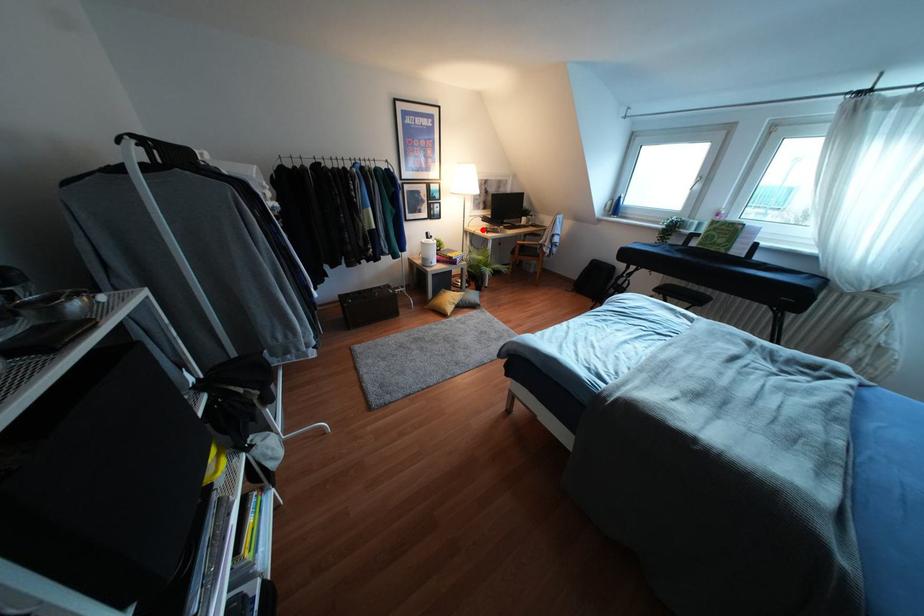
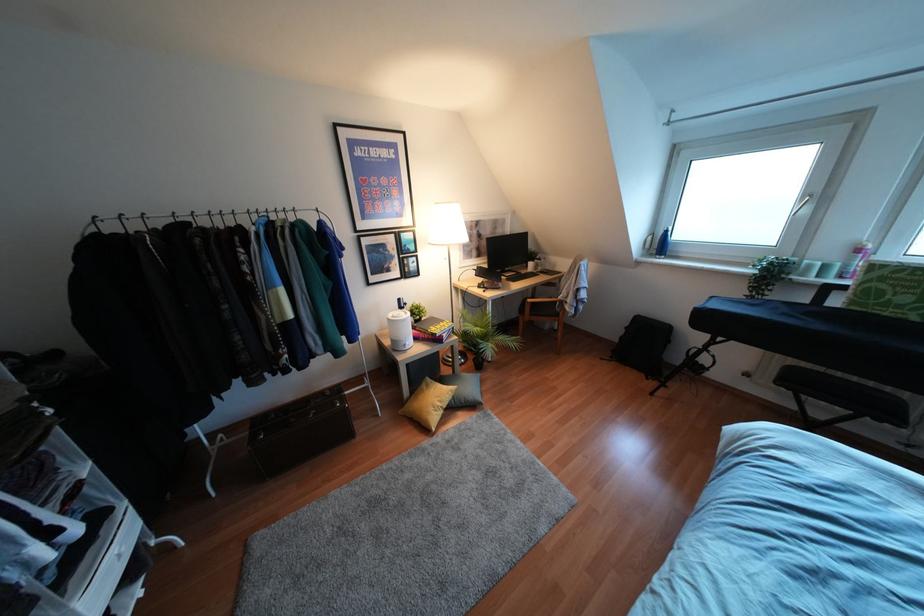
Locate, in the second image, the point that corresponds to the highlighted location in the first image.

(478, 286)